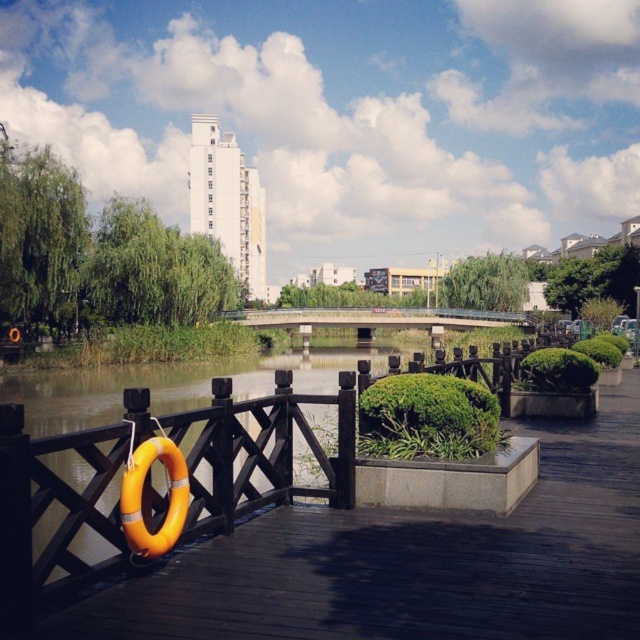
Is orange rubber ring at left to the right of concrete bridge at center from the viewer's perspective?

No, orange rubber ring at left is not to the right of concrete bridge at center.

Between point (406, 573) and point (467, 321), which one is positioned in front?

Point (406, 573)

Does point (195, 588) come behind point (300, 323)?

No, it is not.

Where is `orange rubber ring at left`? orange rubber ring at left is located at coordinates (x=412, y=561).